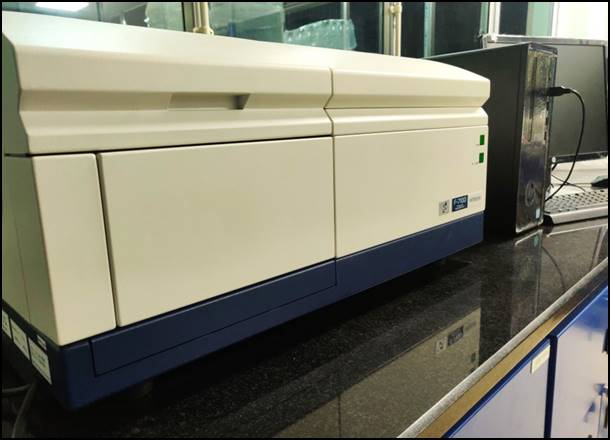
Where is `power cord or usb cord`? Image resolution: width=610 pixels, height=440 pixels. power cord or usb cord is located at coordinates (564, 89).